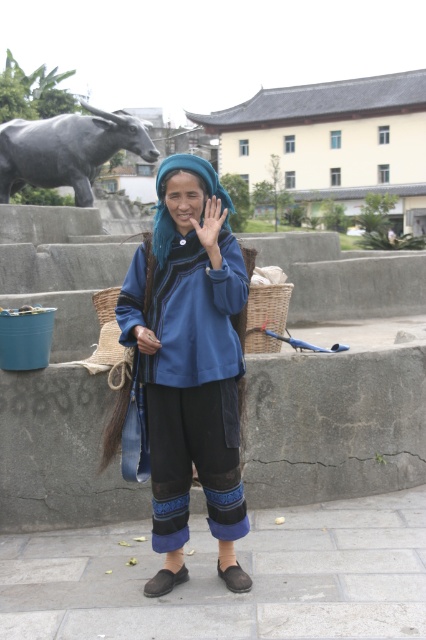
You are a photographer trying to capture a photo of both the blue woven fabric at center and the woven brown basket at lower center. Since you want both objects to appear in the same frame, will you need to adjust your camera angle upwards or downwards?

The blue woven fabric at center is taller than woven brown basket at lower center. To include both in the same frame, you should adjust your camera angle slightly downward to ensure the taller blue woven fabric at center is fully visible while still capturing the shorter woven brown basket at lower center.

You are a visitor in the park and you see the blue woven fabric at center and the woven brown basket at lower center. Which one is closer to the ground?

The blue woven fabric at center is closer to the ground because it is below the woven brown basket at lower center.

You are standing in the park and want to place a small bench between the two points, point (6,189) and point (95,298). Which point should the bench be closer to if you want it to be nearer to the person?

The bench should be closer to point (6,189) because it is closer to the person than point (95,298).